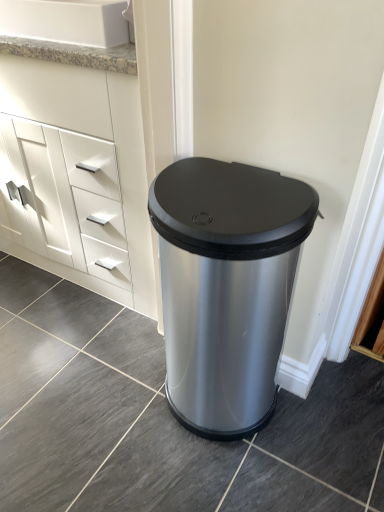
Question: Can you confirm if satin silver trash can at center is smaller than white granite sink at upper left?

Choices:
 (A) no
 (B) yes

Answer: (A)

Question: From a real-world perspective, is satin silver trash can at center physically below white granite sink at upper left?

Choices:
 (A) no
 (B) yes

Answer: (B)

Question: Is satin silver trash can at center in front of white granite sink at upper left?

Choices:
 (A) no
 (B) yes

Answer: (B)

Question: Does satin silver trash can at center come behind white granite sink at upper left?

Choices:
 (A) yes
 (B) no

Answer: (B)

Question: Is satin silver trash can at center at the right side of white granite sink at upper left?

Choices:
 (A) yes
 (B) no

Answer: (A)

Question: Does satin silver trash can at center have a lesser width compared to white granite sink at upper left?

Choices:
 (A) no
 (B) yes

Answer: (A)

Question: Does satin silver trash can at center have a greater height compared to white matte cabinet at left?

Choices:
 (A) no
 (B) yes

Answer: (A)

Question: From a real-world perspective, is satin silver trash can at center located higher than white matte cabinet at left?

Choices:
 (A) yes
 (B) no

Answer: (B)

Question: Is satin silver trash can at center to the right of white matte cabinet at left from the viewer's perspective?

Choices:
 (A) no
 (B) yes

Answer: (B)

Question: Does satin silver trash can at center have a lesser height compared to white matte cabinet at left?

Choices:
 (A) yes
 (B) no

Answer: (A)

Question: Is satin silver trash can at center at the left side of white matte cabinet at left?

Choices:
 (A) no
 (B) yes

Answer: (A)

Question: From the image's perspective, does satin silver trash can at center appear lower than white matte cabinet at left?

Choices:
 (A) no
 (B) yes

Answer: (B)

Question: Is white granite sink at upper left oriented towards white matte cabinet at left?

Choices:
 (A) no
 (B) yes

Answer: (A)